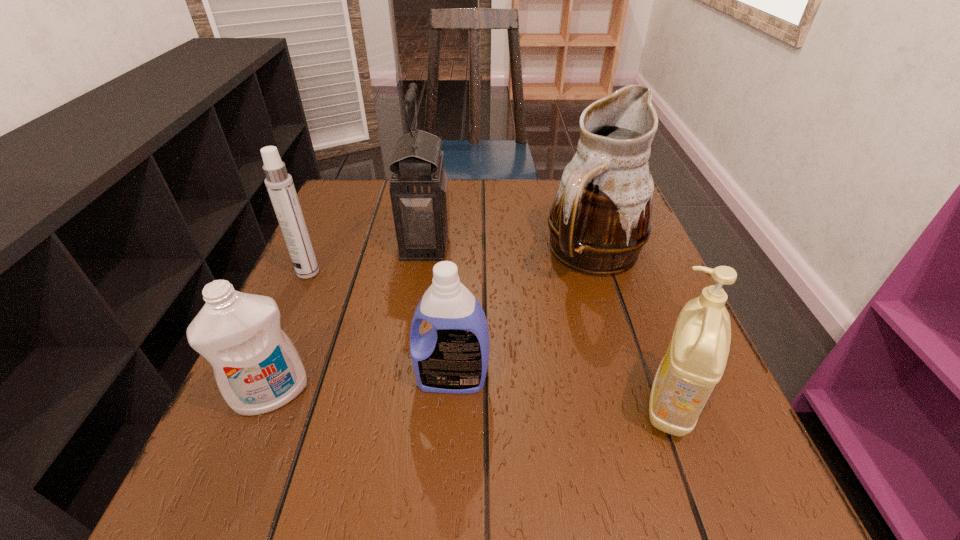
Identify which object is the third nearest to the rightmost detergent. Please provide its 2D coordinates. Your answer should be formatted as a tuple, i.e. [(x, y)], where the tuple contains the x and y coordinates of a point satisfying the conditions above.

[(419, 192)]

In order to click on detergent that is the closest to the pitcher in this screenshot , I will do `click(695, 360)`.

Locate which detergent is the closest to the pitcher. Please provide its 2D coordinates. Your answer should be formatted as a tuple, i.e. [(x, y)], where the tuple contains the x and y coordinates of a point satisfying the conditions above.

[(695, 360)]

Where is `free spot that satisfies the following two spatial constraints: 1. on the front-facing side of the second detergent from left to right; 2. on the left side of the lantern`? This screenshot has height=540, width=960. free spot that satisfies the following two spatial constraints: 1. on the front-facing side of the second detergent from left to right; 2. on the left side of the lantern is located at coordinates (403, 379).

I want to click on vacant space that satisfies the following two spatial constraints: 1. from the spout of the rightmost detergent; 2. on the left side of the pitcher, so click(x=641, y=403).

Find the location of a particular element. free region that satisfies the following two spatial constraints: 1. on the front-facing side of the lantern; 2. on the front side of the leftmost detergent is located at coordinates (401, 394).

The width and height of the screenshot is (960, 540). I want to click on blank area in the image that satisfies the following two spatial constraints: 1. on the front side of the rightmost detergent; 2. on the left side of the second detergent from right to left, so click(x=450, y=403).

Where is `free spot that satisfies the following two spatial constraints: 1. on the front side of the aerosol can; 2. on the left side of the rightmost detergent`? free spot that satisfies the following two spatial constraints: 1. on the front side of the aerosol can; 2. on the left side of the rightmost detergent is located at coordinates (249, 403).

This screenshot has height=540, width=960. In order to click on vacant space that satisfies the following two spatial constraints: 1. on the front-facing side of the rightmost detergent; 2. on the right side of the lantern in this screenshot , I will do `click(399, 403)`.

The image size is (960, 540). I want to click on vacant space that satisfies the following two spatial constraints: 1. on the front side of the leftmost detergent; 2. on the right side of the rightmost detergent, so click(269, 403).